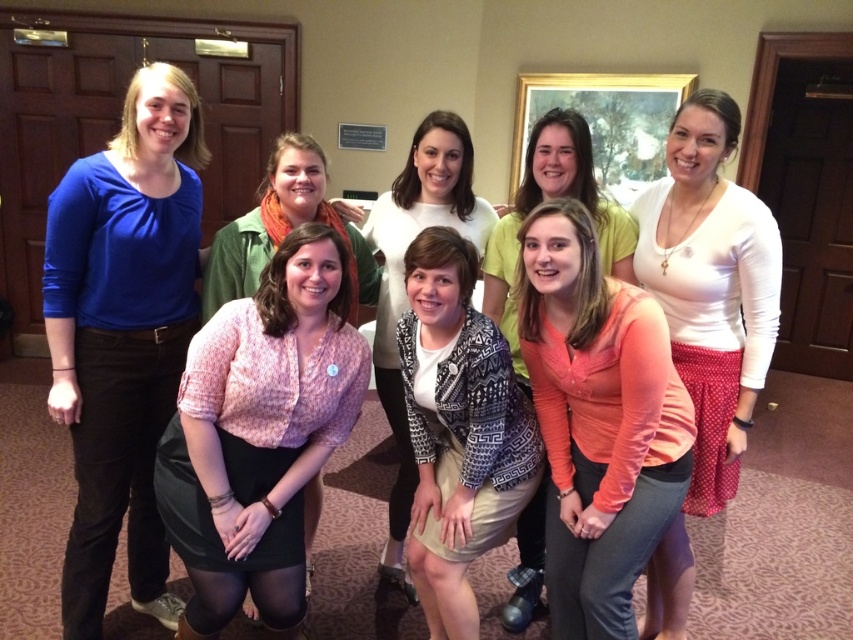
You are standing in the room and want to find the matte blue blouse at upper left. According to the coordinates provided, where should you look relative to the framed picture on the wall?

The matte blue blouse at upper left is located at point coordinates, so you should look towards the upper left area of the image to find it.